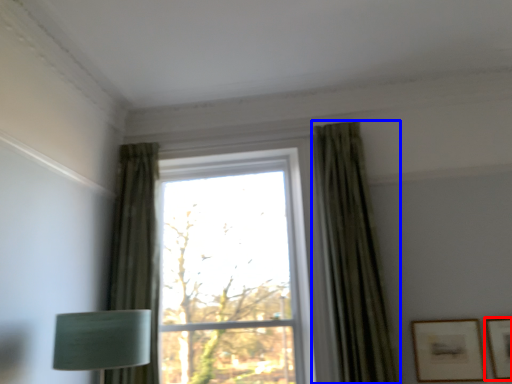
Question: Which object is further to the camera taking this photo, picture frame (highlighted by a red box) or curtain (highlighted by a blue box)?

Choices:
 (A) picture frame
 (B) curtain

Answer: (A)